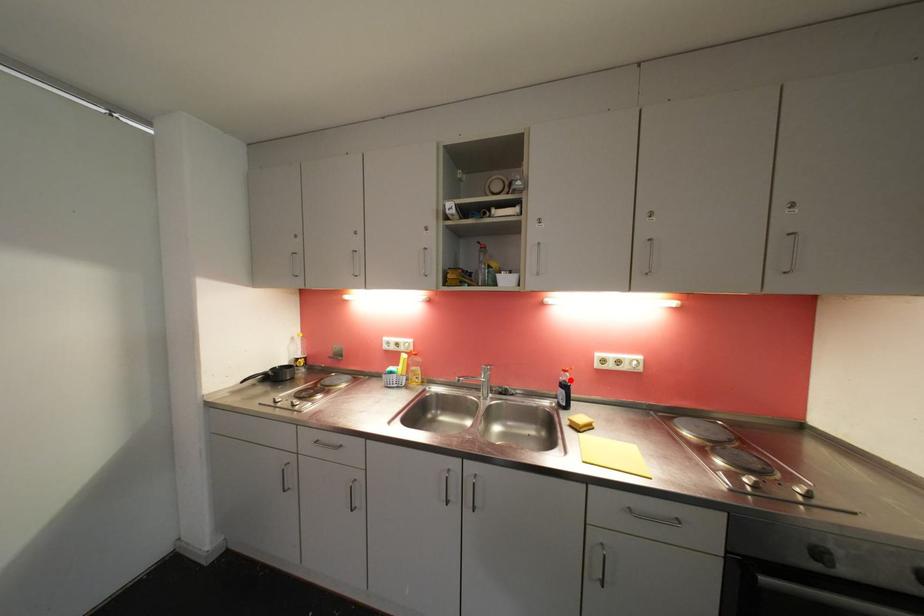
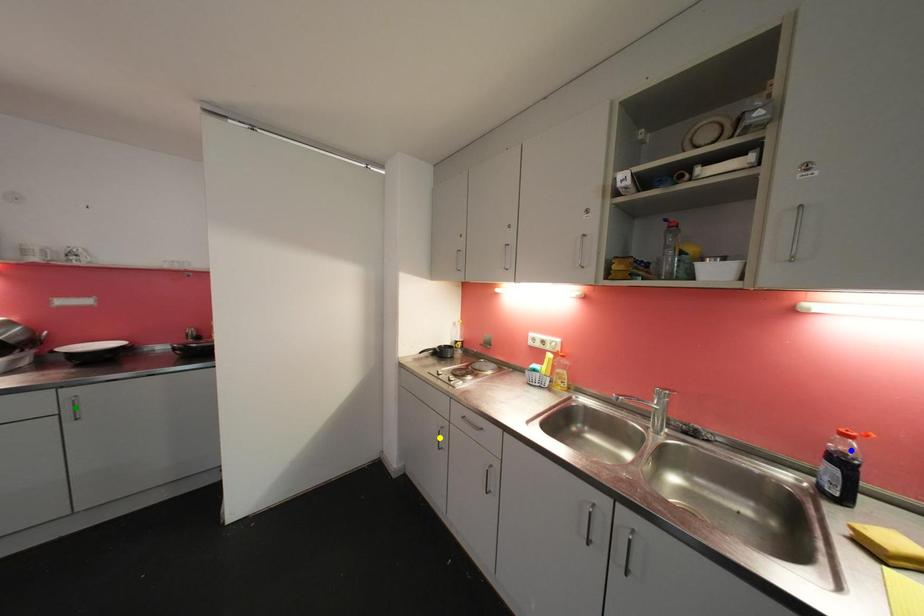
Question: I am providing you with two images of the same scene from different viewpoints. A red point is marked on the first image. You are given multiple points on the second image. Which mark in image 2 goes with the point in image 1?

Choices:
 (A) yellow point
 (B) green point
 (C) blue point

Answer: (C)